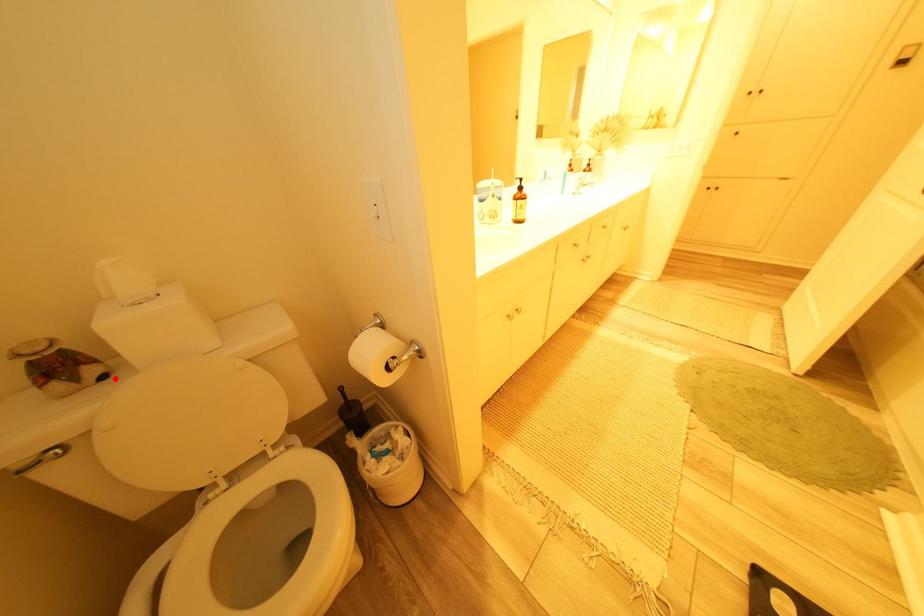
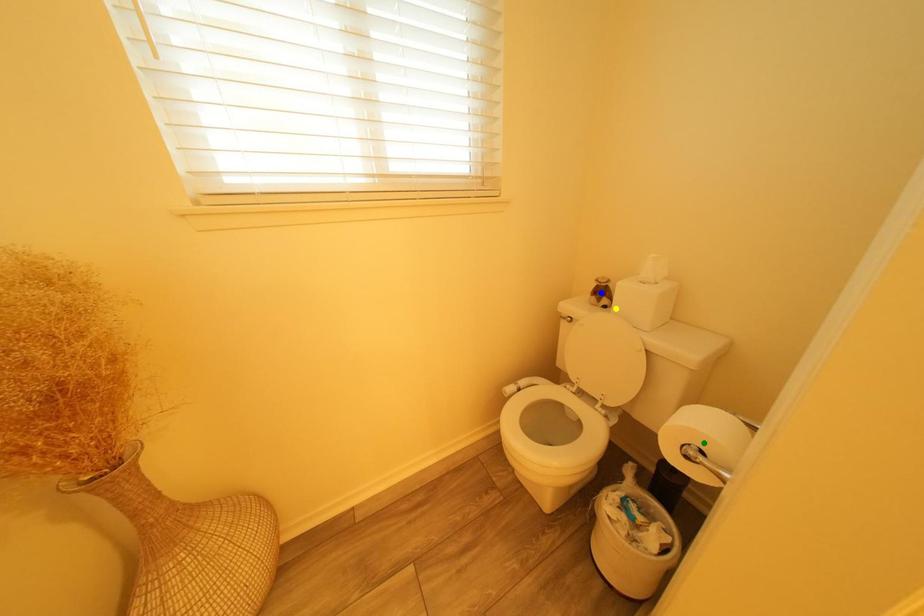
Question: I am providing you with two images of the same scene from different viewpoints. A red point is marked on the first image. You are given multiple points on the second image. Which point in image 2 is actually the same real-world point as the red point in image 1?

Choices:
 (A) yellow point
 (B) blue point
 (C) green point

Answer: (A)